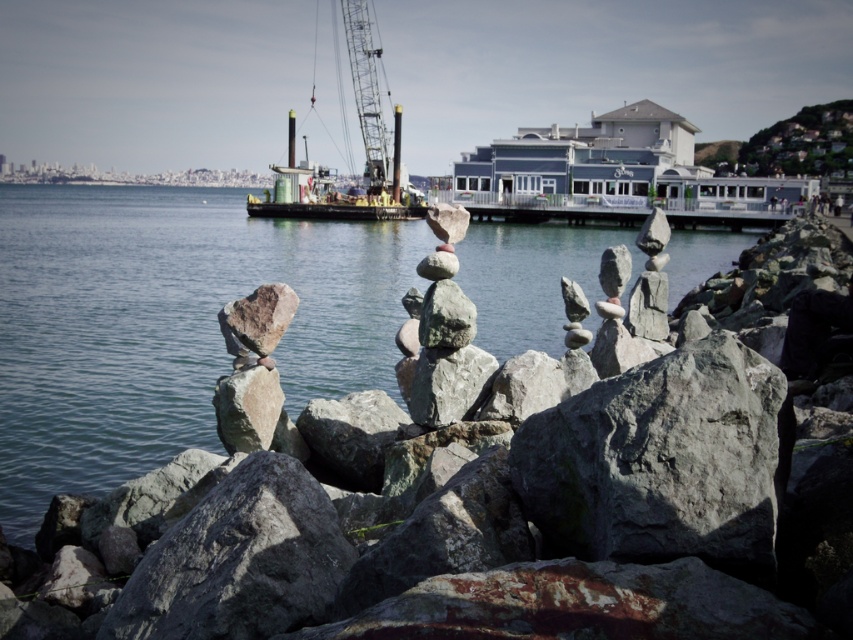
Can you confirm if clear water at center is taller than metallic yellow crane at upper center?

In fact, clear water at center may be shorter than metallic yellow crane at upper center.

Who is taller, clear water at center or metallic yellow crane at upper center?

metallic yellow crane at upper center

Is point (277, 278) farther from viewer compared to point (369, 164)?

No, it is in front of (369, 164).

Where is `clear water at center`? The height and width of the screenshot is (640, 853). clear water at center is located at coordinates (167, 324).

Can you confirm if clear water at center is bigger than metallic gray crane at center?

Correct, clear water at center is larger in size than metallic gray crane at center.

Find the location of a particular element. The image size is (853, 640). clear water at center is located at coordinates (167, 324).

Where is `clear water at center`? This screenshot has width=853, height=640. clear water at center is located at coordinates (167, 324).

Does metallic yellow crane at upper center appear on the left side of metallic gray crane at center?

In fact, metallic yellow crane at upper center is to the right of metallic gray crane at center.

Is point (360, 113) positioned in front of point (366, 77)?

Yes, it is in front of point (366, 77).

What do you see at coordinates (363, 141) in the screenshot? I see `metallic yellow crane at upper center` at bounding box center [363, 141].

I want to click on metallic yellow crane at upper center, so click(x=363, y=141).